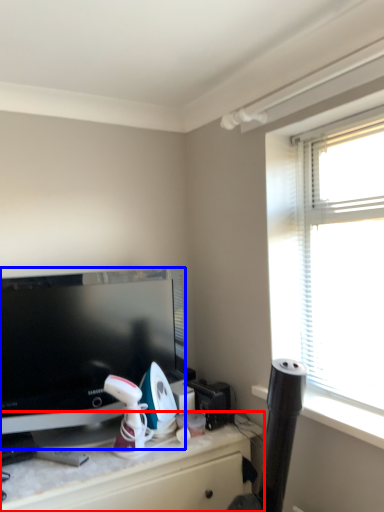
Question: Which object appears farthest to the camera in this image, desk (highlighted by a red box) or television (highlighted by a blue box)?

Choices:
 (A) desk
 (B) television

Answer: (B)